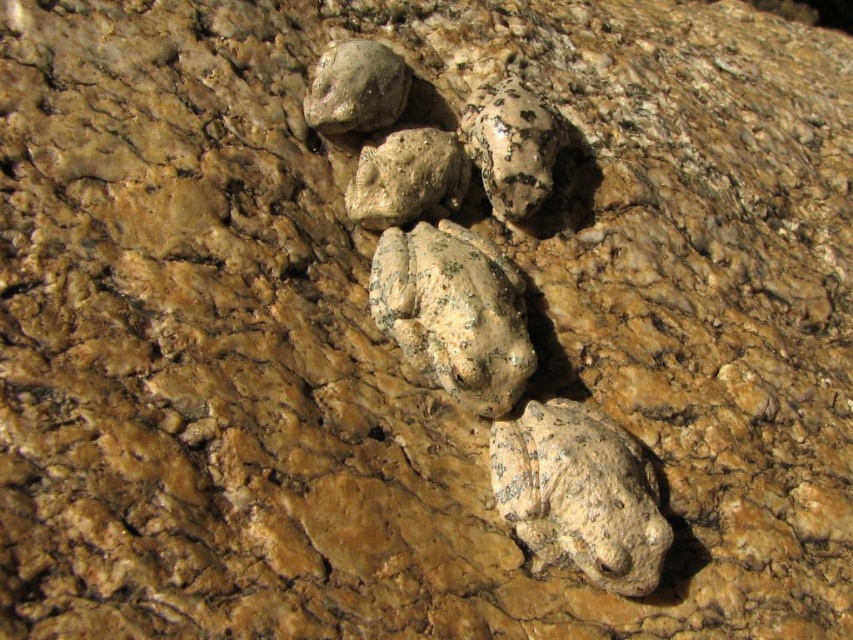
Question: Estimate the real-world distances between objects in this image. Which object is closer to the speckled stone frog at lower right?

Choices:
 (A) speckled stone frog at upper center
 (B) speckled stone frog at center
 (C) rough textured rock at upper center

Answer: (B)

Question: Estimate the real-world distances between objects in this image. Which object is farther from the speckled stone frog at center?

Choices:
 (A) speckled stone frog at upper center
 (B) rough textured rock at upper center

Answer: (B)

Question: Does speckled stone frog at lower right come in front of rough textured rock at upper center?

Choices:
 (A) yes
 (B) no

Answer: (A)

Question: Based on their relative distances, which object is farther from the rough textured rock at upper center?

Choices:
 (A) speckled stone frog at upper center
 (B) speckled stone frog at lower right
 (C) speckled stone frog at center

Answer: (B)

Question: Does speckled stone frog at lower right have a smaller size compared to rough textured rock at upper center?

Choices:
 (A) yes
 (B) no

Answer: (B)

Question: Can you confirm if speckled stone frog at lower right is thinner than rough textured rock at upper center?

Choices:
 (A) no
 (B) yes

Answer: (A)